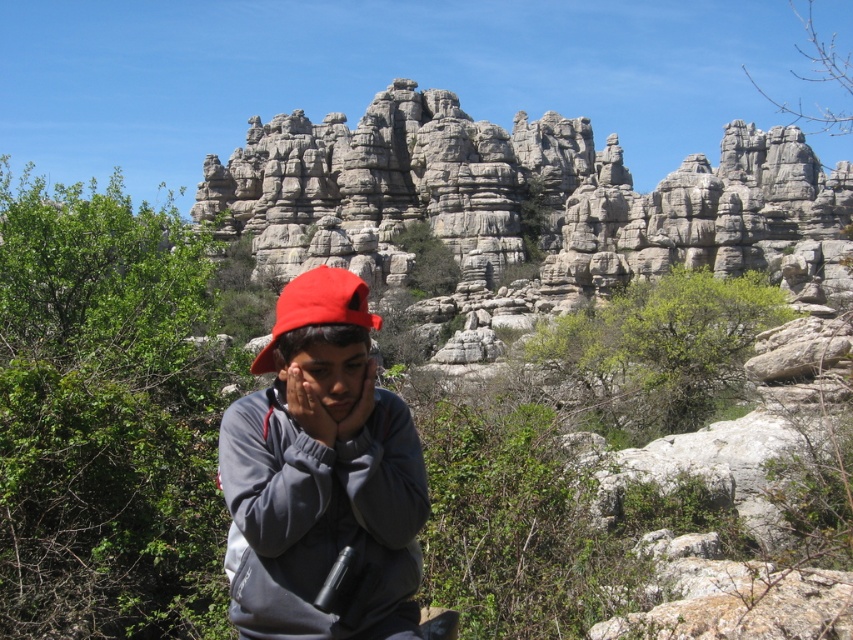
Is gray rocky cliff at center positioned in front of red fabric hat at center?

No, it is not.

Between gray rocky cliff at center and red fabric hat at center, which one has less height?

red fabric hat at center

The width and height of the screenshot is (853, 640). What do you see at coordinates (520, 202) in the screenshot?
I see `gray rocky cliff at center` at bounding box center [520, 202].

Identify the location of gray rocky cliff at center. This screenshot has height=640, width=853. click(520, 202).

What do you see at coordinates (321, 474) in the screenshot? I see `matte gray sweatshirt at center` at bounding box center [321, 474].

Is point (408, 483) farther from viewer compared to point (316, 298)?

No.

You are a GUI agent. You are given a task and a screenshot of the screen. Output one action in this format:
    pyautogui.click(x=<x>, y=<y>)
    Task: Click on the matte gray sweatshirt at center
    The image size is (853, 640).
    Given the screenshot: What is the action you would take?
    pyautogui.click(x=321, y=474)

Is gray rocky cliff at center closer to camera compared to matte gray sweatshirt at center?

No, gray rocky cliff at center is behind matte gray sweatshirt at center.

Can you confirm if gray rocky cliff at center is thinner than matte gray sweatshirt at center?

In fact, gray rocky cliff at center might be wider than matte gray sweatshirt at center.

What do you see at coordinates (520, 202) in the screenshot?
I see `gray rocky cliff at center` at bounding box center [520, 202].

At what (x,y) coordinates should I click in order to perform the action: click on gray rocky cliff at center. Please return your answer as a coordinate pair (x, y). The image size is (853, 640). Looking at the image, I should click on 520,202.